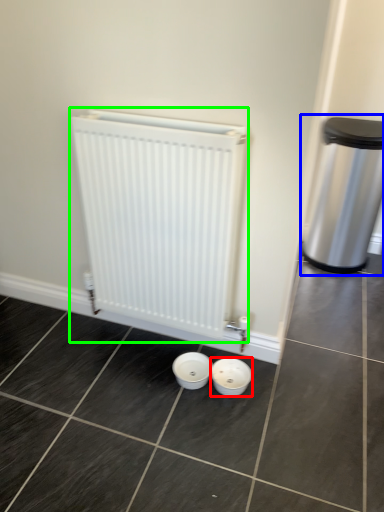
Question: Based on their relative distances, which object is farther from basin (highlighted by a red box)? Choose from waste container (highlighted by a blue box) and radiator (highlighted by a green box).

Choices:
 (A) waste container
 (B) radiator

Answer: (A)